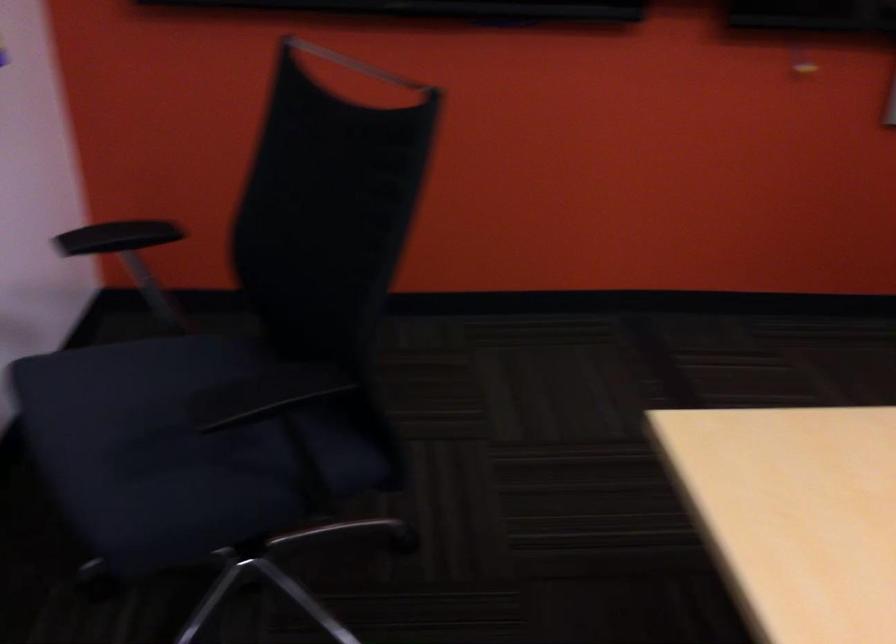
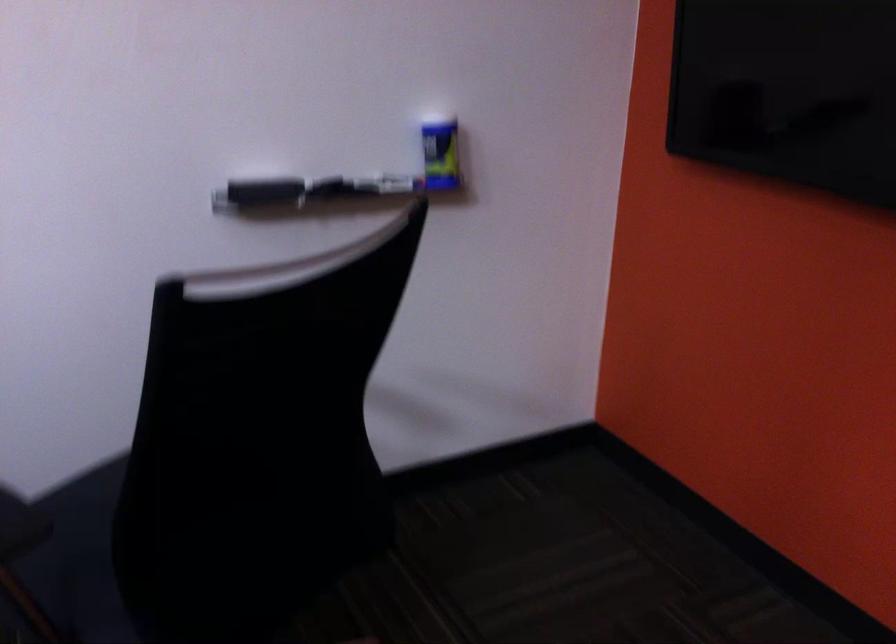
Question: I am providing you with two images of the same scene from different viewpoints. Which of the following objects are not visible in image2?

Choices:
 (A) blue and yellow can
 (B) black chair armrest
 (C) small closed box
 (D) black marker

Answer: (B)